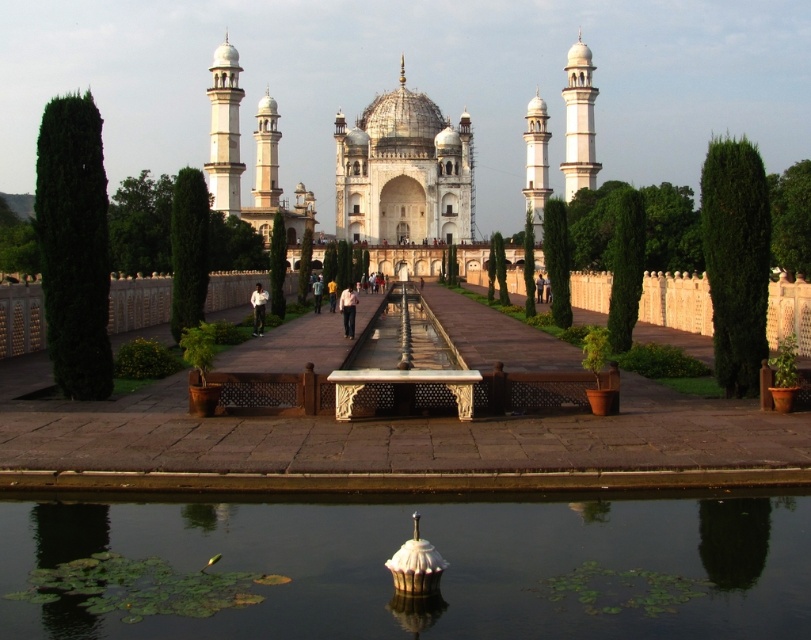
You are a visitor standing in front of the mausoleum and want to take a photo that includes both the transparent glass water at center and the white marble palace at center. Which object should you frame first to ensure both are visible in the photo?

You should frame the white marble palace at center first because it occupies more space than the transparent glass water at center, so ensuring it fits will allow the smaller transparent glass water at center to also be visible.

You are standing in front of the grand mausoleum with its symmetrical domes and minarets. You notice a point marked at coordinates (389,572). Based on the scene description, what object is located at this point?

The point at (389,572) indicates transparent glass water at center.